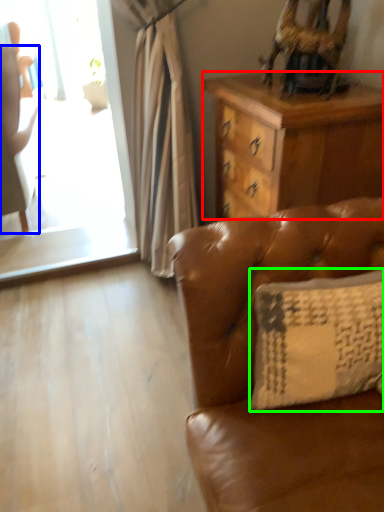
Question: Considering the real-world distances, which object is farthest from desk (highlighted by a red box)? chair (highlighted by a blue box) or pillow (highlighted by a green box)?

Choices:
 (A) chair
 (B) pillow

Answer: (A)